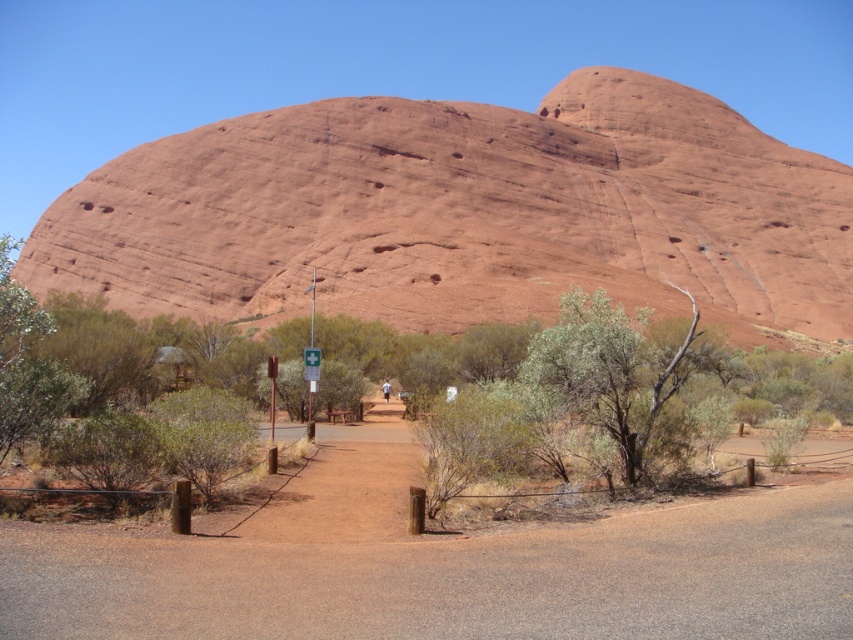
You are a tourist standing at the entrance of the Uluru hiking trail. You see the brown dirt track at center and the green plastic sign at center. According to the sign, which direction should you go to start the trail?

The brown dirt track at center is to the right of the green plastic sign at center, so you should go to the right of the sign to start the trail.